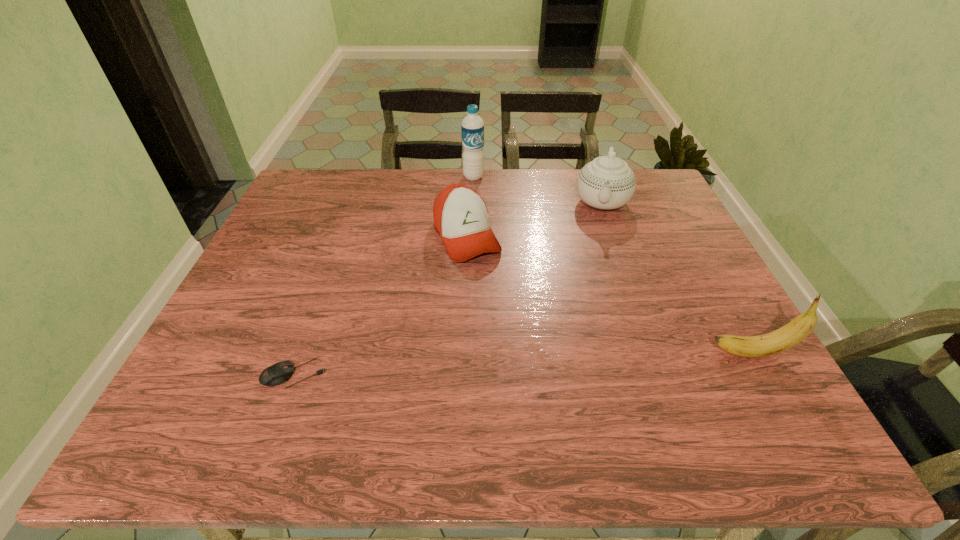
Find the location of a particular element. Image resolution: width=960 pixels, height=540 pixels. blank space that satisfies the following two spatial constraints: 1. on the back side of the water bottle; 2. on the right side of the second shortest object is located at coordinates (468, 177).

This screenshot has width=960, height=540. Find the location of `free space that satisfies the following two spatial constraints: 1. on the front side of the banana; 2. at the start of the peel on the second shortest object`. free space that satisfies the following two spatial constraints: 1. on the front side of the banana; 2. at the start of the peel on the second shortest object is located at coordinates [x=462, y=353].